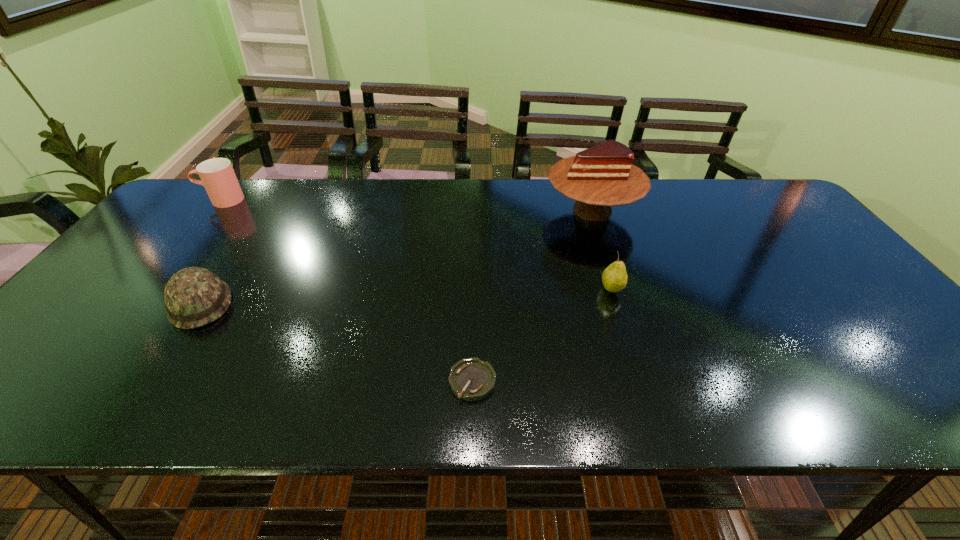
You are a GUI agent. You are given a task and a screenshot of the screen. Output one action in this format:
    pyautogui.click(x=<x>, y=<y>)
    Task: Click on the cake
    
    Given the screenshot: What is the action you would take?
    pyautogui.click(x=602, y=176)

The height and width of the screenshot is (540, 960). I want to click on the leftmost object, so click(217, 175).

Locate an element on the screen. This screenshot has height=540, width=960. the second tallest object is located at coordinates (217, 175).

In order to click on pear in this screenshot , I will do `click(614, 278)`.

Where is `the fourth object from right to left`? The width and height of the screenshot is (960, 540). the fourth object from right to left is located at coordinates (194, 296).

Find the location of a particular element. the shortest object is located at coordinates click(x=471, y=379).

This screenshot has height=540, width=960. I want to click on the third object from right to left, so click(x=471, y=379).

The width and height of the screenshot is (960, 540). Find the location of `free space located 0.220m on the front of the cake`. free space located 0.220m on the front of the cake is located at coordinates (620, 292).

What are the coordinates of `vacant area situated 0.070m on the side of the leftmost object with the handle` in the screenshot? It's located at (179, 200).

The image size is (960, 540). I want to click on free space located on the right of the pear, so click(x=674, y=289).